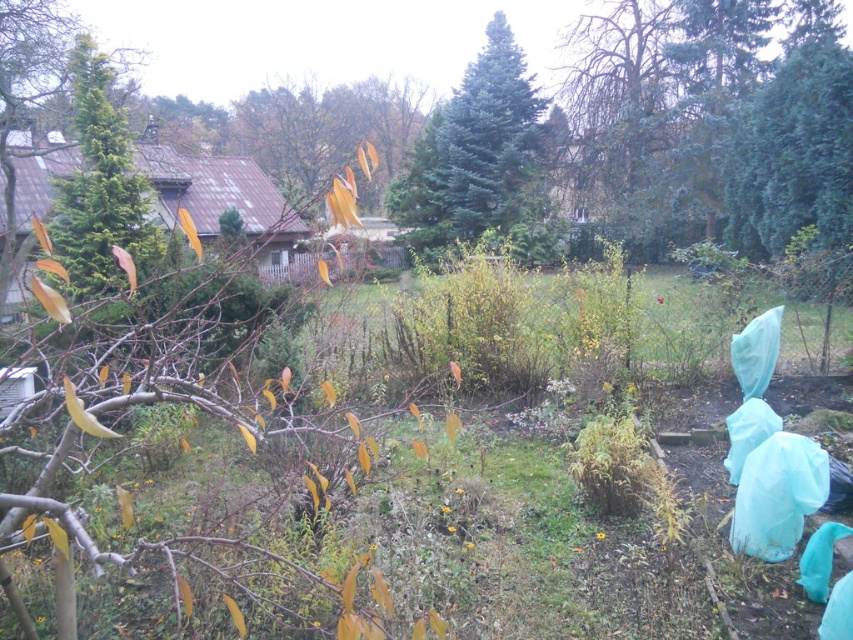
You are standing in the garden and want to locate the green matte evergreen tree at center. According to the coordinates provided, where should you look?

The green matte evergreen tree at center is located at point (480, 161).